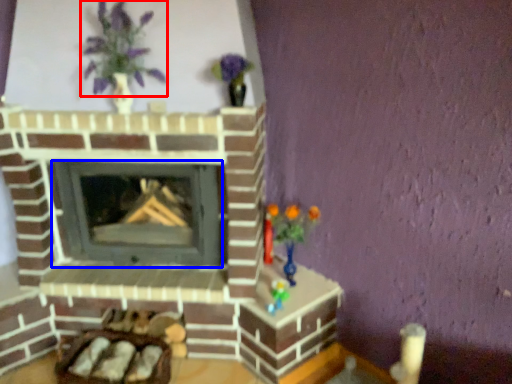
Question: Which object appears farthest to the camera in this image, floral arrangement (highlighted by a red box) or wood burning stove (highlighted by a blue box)?

Choices:
 (A) floral arrangement
 (B) wood burning stove

Answer: (B)